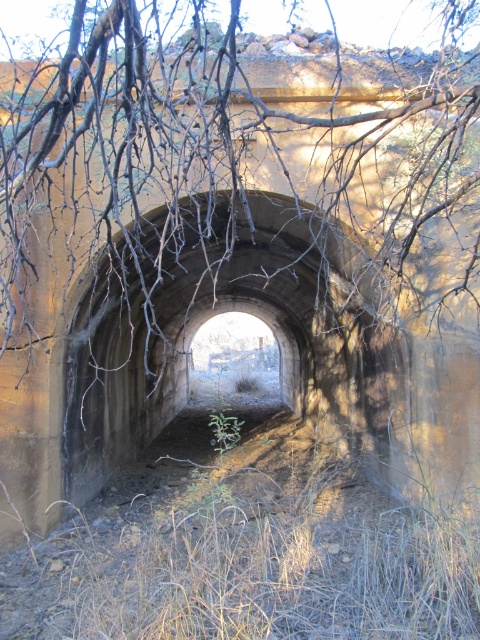
Between point (62, 88) and point (257, 257), which one is positioned in front?

Positioned in front is point (62, 88).

Consider the image. Does brown dry branches at upper center appear under concrete tunnel at center?

No.

This screenshot has height=640, width=480. I want to click on brown dry branches at upper center, so click(228, 184).

Does point (110, 35) come farther from viewer compared to point (216, 445)?

No.

Measure the distance between brown dry branches at upper center and green fuzzy plant at center.

They are 8.24 meters apart.

Who is more forward, (418,282) or (216,432)?

Point (216,432) is in front.

Identify the location of brown dry branches at upper center. [228, 184].

Who is higher up, concrete tunnel at center or green fuzzy plant at center?

concrete tunnel at center is above.

Which is more to the right, concrete tunnel at center or green fuzzy plant at center?

Positioned to the right is green fuzzy plant at center.

Locate an element on the screen. This screenshot has width=480, height=640. concrete tunnel at center is located at coordinates (224, 310).

Where is `concrete tunnel at center`? The height and width of the screenshot is (640, 480). concrete tunnel at center is located at coordinates (224, 310).